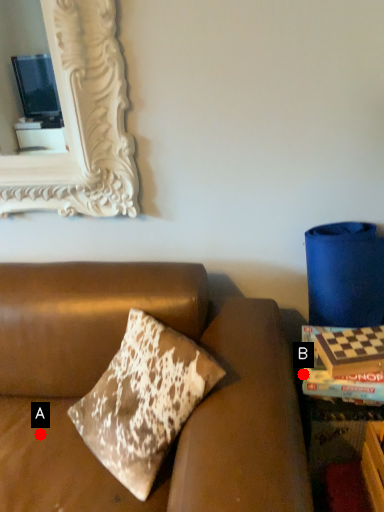
Question: Two points are circled on the image, labeled by A and B beside each circle. Which of the following is the farthest from the observer?

Choices:
 (A) A is further
 (B) B is further

Answer: (B)